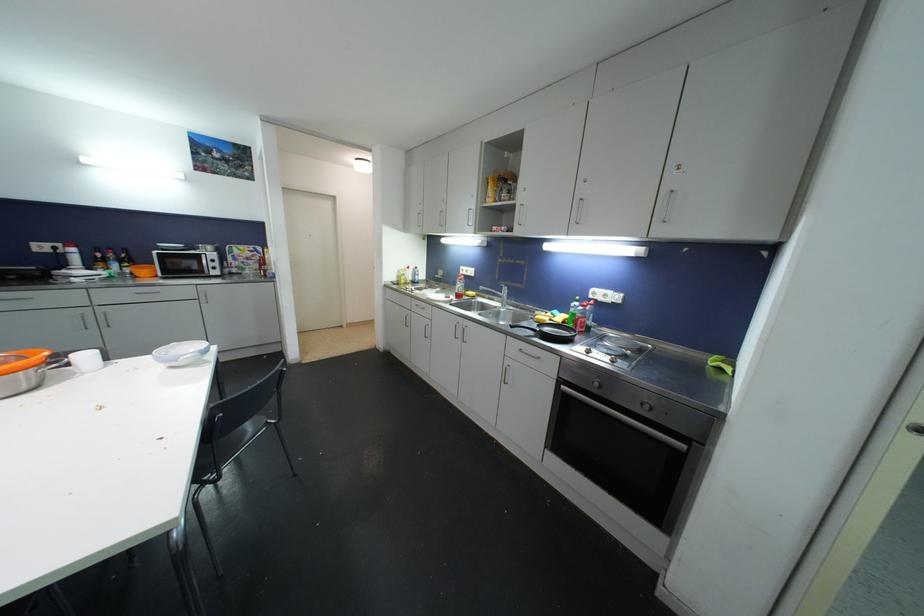
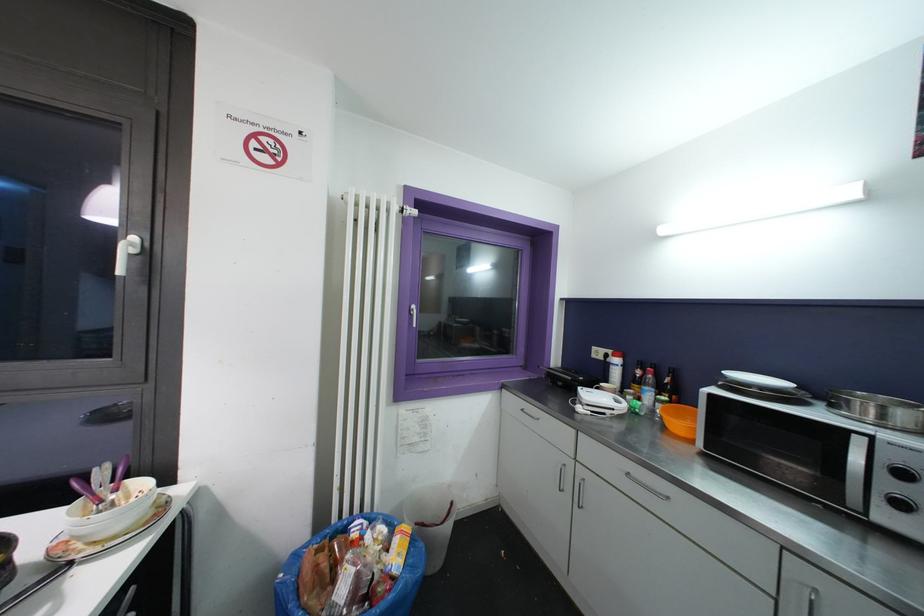
Locate, in the second image, the point that corresponds to (79,262) in the first image.

(618, 376)